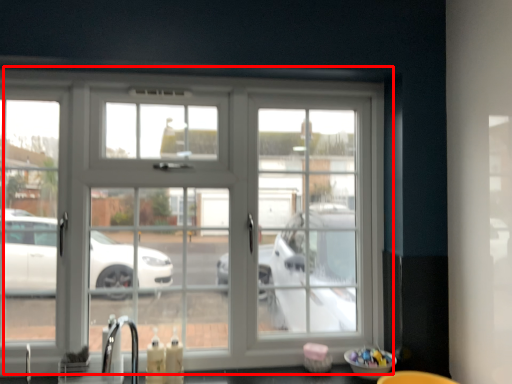
Question: From the image, what is the correct spatial relationship of window (annotated by the red box) in relation to faucet?

Choices:
 (A) left
 (B) right

Answer: (B)